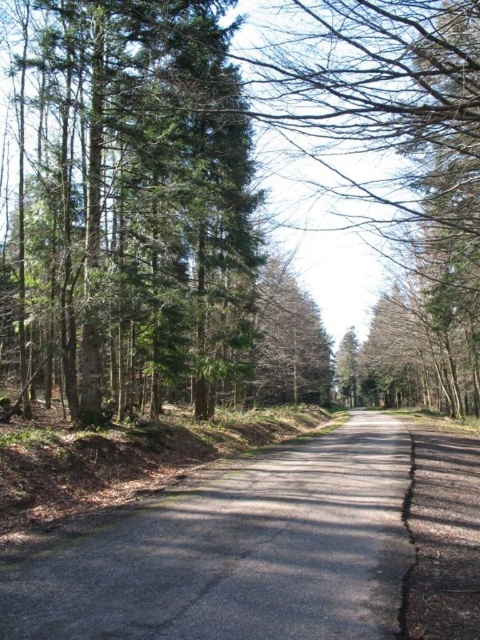
Question: Does green matte tree at left have a greater width compared to smooth asphalt road at center?

Choices:
 (A) yes
 (B) no

Answer: (A)

Question: Which point is closer to the camera?

Choices:
 (A) smooth asphalt road at center
 (B) green matte tree at left

Answer: (A)

Question: Which object appears closest to the camera in this image?

Choices:
 (A) green matte tree at left
 (B) smooth asphalt road at center

Answer: (B)

Question: Does green matte tree at left appear on the right side of smooth asphalt road at center?

Choices:
 (A) yes
 (B) no

Answer: (B)

Question: Where is green matte tree at left located in relation to smooth asphalt road at center in the image?

Choices:
 (A) above
 (B) below

Answer: (A)